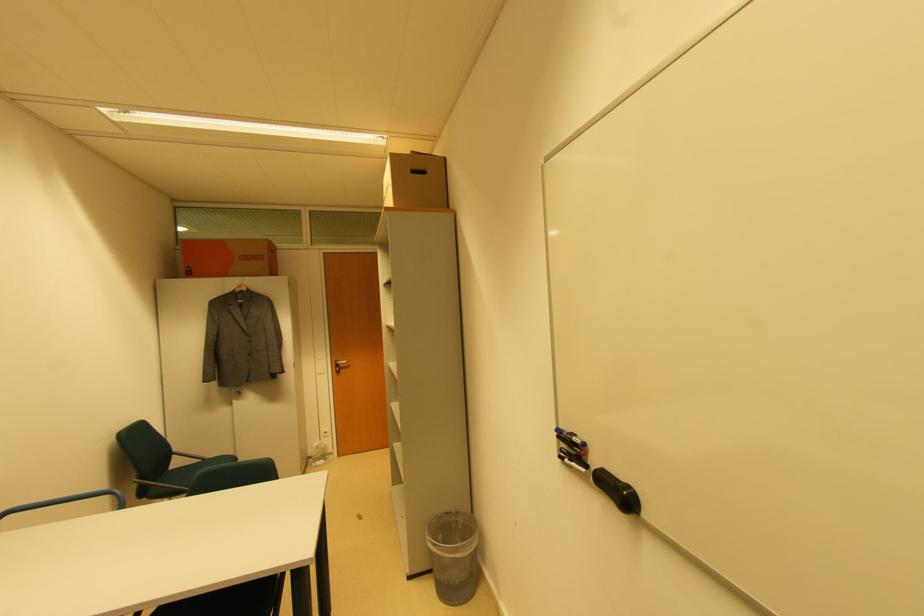
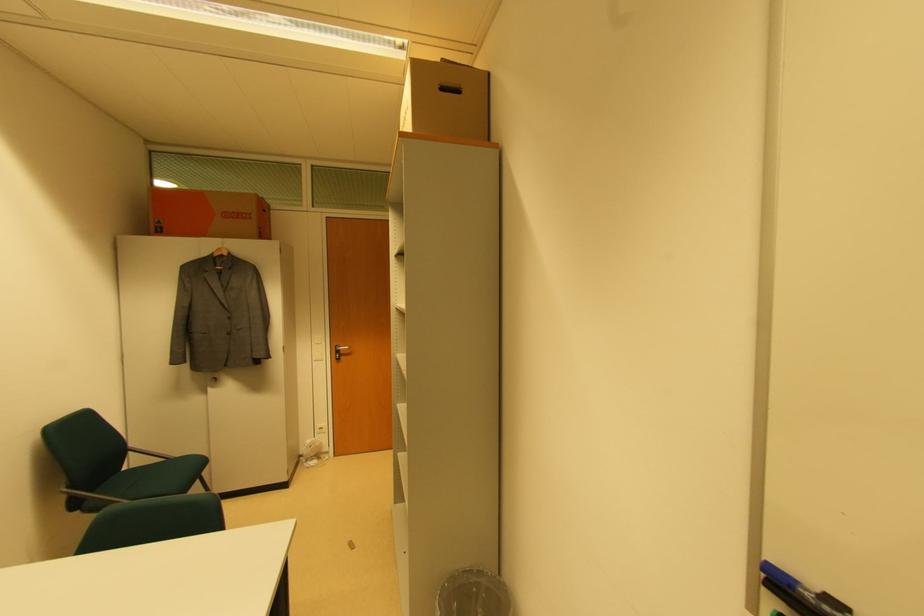
Locate, in the second image, the point that corresponds to [415,175] in the first image.

(444, 91)